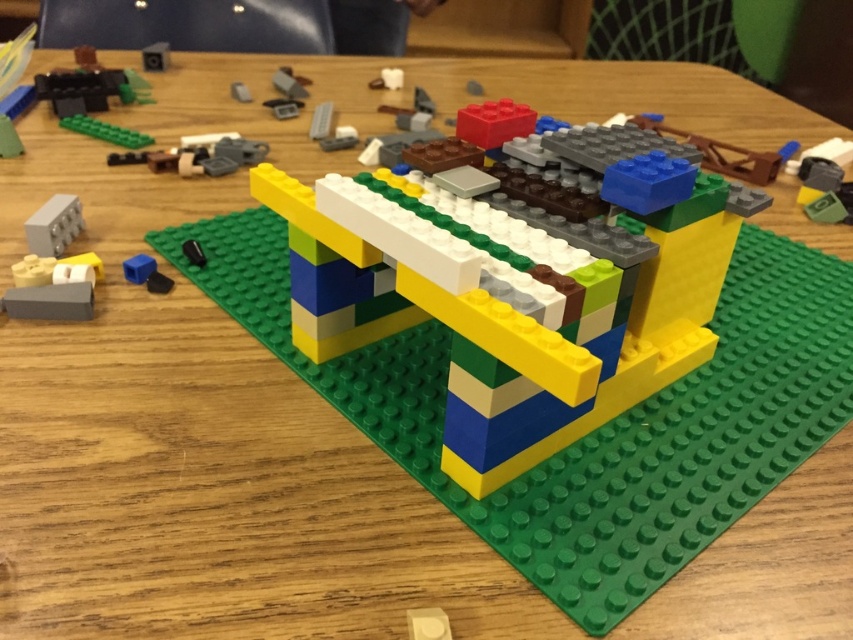
Does matte plastic bridge at center appear on the right side of gray matte brick at upper left?

Indeed, matte plastic bridge at center is positioned on the right side of gray matte brick at upper left.

Can you confirm if matte plastic bridge at center is thinner than gray matte brick at upper left?

No.

The height and width of the screenshot is (640, 853). I want to click on matte plastic bridge at center, so click(517, 284).

The image size is (853, 640). In order to click on matte plastic bridge at center in this screenshot , I will do `click(517, 284)`.